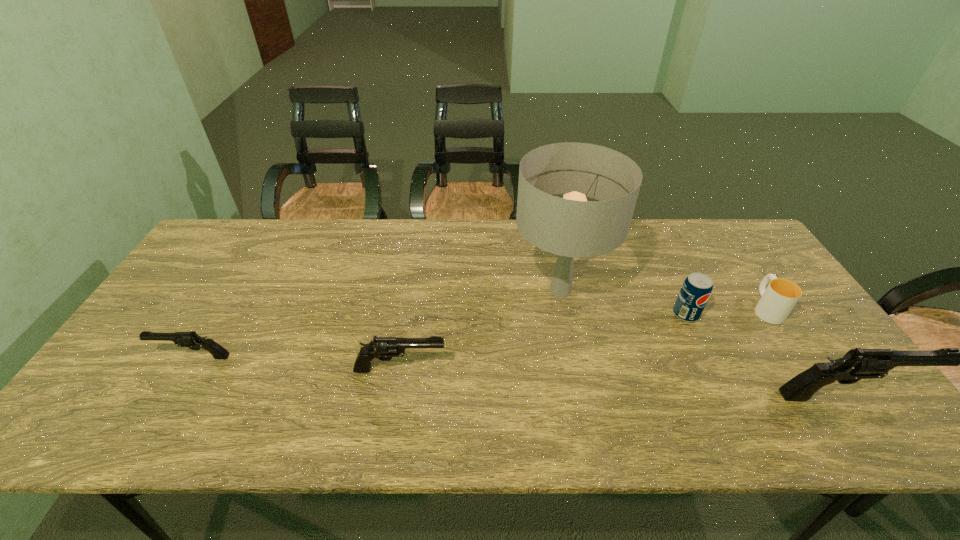
The height and width of the screenshot is (540, 960). Find the location of `object that is positioned at the left edge`. object that is positioned at the left edge is located at coordinates (191, 340).

This screenshot has width=960, height=540. In order to click on gun that is positioned at the right edge in this screenshot , I will do `click(856, 364)`.

Locate an element on the screen. The height and width of the screenshot is (540, 960). cup situated at the right edge is located at coordinates point(777,301).

In order to click on object that is positioned at the near right corner in this screenshot , I will do `click(856, 364)`.

Find the location of `free region at the far edge of the desktop`. free region at the far edge of the desktop is located at coordinates (455, 237).

This screenshot has height=540, width=960. Identify the location of vacant area at the near edge of the desktop. (393, 393).

In the image, there is a desktop. Where is `vacant region at the left edge`? This screenshot has height=540, width=960. vacant region at the left edge is located at coordinates (215, 310).

Locate an element on the screen. Image resolution: width=960 pixels, height=540 pixels. blank area at the far left corner is located at coordinates (242, 240).

Locate an element on the screen. The height and width of the screenshot is (540, 960). vacant region at the far right corner is located at coordinates (746, 254).

You are a GUI agent. You are given a task and a screenshot of the screen. Output one action in this format:
    pyautogui.click(x=<x>, y=<y>)
    Task: Click on the blank space at the near right corner
    The image size is (960, 540).
    Given the screenshot: What is the action you would take?
    pyautogui.click(x=852, y=387)